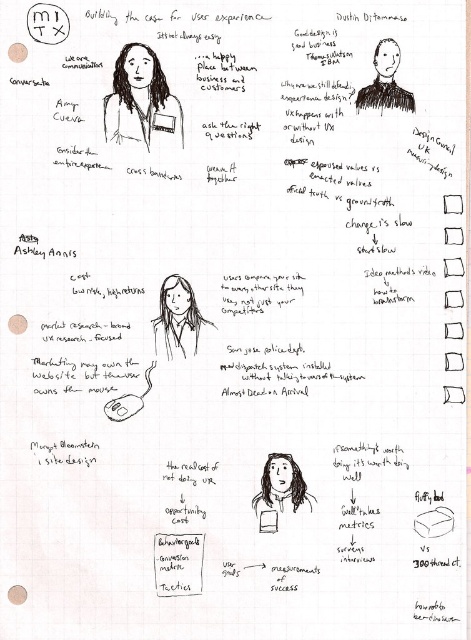
Between matte black jacket at upper left and matte black shirt at center, which one has more height?

With more height is matte black jacket at upper left.

The image size is (471, 640). In order to click on matte black jacket at upper left in this screenshot , I will do `click(140, 99)`.

Locate an element on the screen. matte black jacket at upper left is located at coordinates (140, 99).

Between matte black hair at center and white paper at center, which one appears on the right side from the viewer's perspective?

matte black hair at center is more to the right.

Can you confirm if matte black hair at center is positioned below white paper at center?

No.

Is point (285, 509) closer to camera compared to point (259, 524)?

No, it is behind (259, 524).

In order to click on matte black hair at center in this screenshot , I will do `click(282, 486)`.

Who is shorter, matte black jacket at upper left or matte black hair at center?

Standing shorter between the two is matte black hair at center.

Can you confirm if matte black jacket at upper left is wider than matte black hair at center?

Correct, the width of matte black jacket at upper left exceeds that of matte black hair at center.

Identify the location of matte black jacket at upper left. This screenshot has width=471, height=640. (140, 99).

In order to click on matte black jacket at upper left in this screenshot , I will do (140, 99).